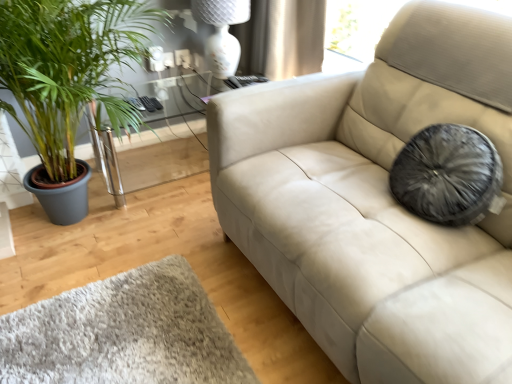
Describe the element at coordinates (68, 69) in the screenshot. I see `green leafy plant at left` at that location.

Describe the element at coordinates (167, 133) in the screenshot. I see `clear glass table at left` at that location.

Identify the location of clear glass table at left. (167, 133).

Locate an element on the screen. Image resolution: width=512 pixels, height=384 pixels. white glossy lamp at upper center is located at coordinates (222, 33).

At what (x,y) coordinates should I click in order to perform the action: click on table on the right of green leafy plant at left. Please return your answer as a coordinate pair (x, y). This screenshot has height=384, width=512. Looking at the image, I should click on (167, 133).

Could you tell me if clear glass table at left is facing green leafy plant at left?

Yes, clear glass table at left is aimed at green leafy plant at left.

Does clear glass table at left have a lesser height compared to green leafy plant at left?

Correct, clear glass table at left is not as tall as green leafy plant at left.

Is clear glass table at left far away from green leafy plant at left?

They are positioned close to each other.

Based on the photo, can we say white glossy lamp at upper center lies outside clear glass table at left?

Yes, white glossy lamp at upper center is outside of clear glass table at left.

Which object is positioned more to the left, white glossy lamp at upper center or clear glass table at left?

Positioned to the left is clear glass table at left.

Between white glossy lamp at upper center and clear glass table at left, which one has smaller size?

With smaller size is white glossy lamp at upper center.

This screenshot has height=384, width=512. In order to click on lamp behind the clear glass table at left in this screenshot , I will do `click(222, 33)`.

From a real-world perspective, which object stands above the other?

white glossy lamp at upper center, from a real-world perspective.

Measure the distance between clear glass table at left and white glossy lamp at upper center.

clear glass table at left and white glossy lamp at upper center are 17.45 inches apart.

Is clear glass table at left closer to the viewer compared to white glossy lamp at upper center?

That is True.

In the scene shown: Do you think clear glass table at left is within white glossy lamp at upper center, or outside of it?

clear glass table at left is spatially situated outside white glossy lamp at upper center.

Considering the relative positions of white glossy lamp at upper center and green leafy plant at left in the image provided, is white glossy lamp at upper center in front of green leafy plant at left?

No, white glossy lamp at upper center is behind green leafy plant at left.

Consider the image. Between white glossy lamp at upper center and green leafy plant at left, which one has larger size?

green leafy plant at left is bigger.

From a real-world perspective, is white glossy lamp at upper center beneath green leafy plant at left?

Incorrect, from a real-world perspective, white glossy lamp at upper center is higher than green leafy plant at left.

Which point is more forward, (233, 1) or (123, 33)?

The point (123, 33) is in front.

How much distance is there between green leafy plant at left and clear glass table at left?

green leafy plant at left is 50.92 centimeters from clear glass table at left.

From the image's perspective, between green leafy plant at left and clear glass table at left, which one is located above?

green leafy plant at left.

Could you tell me if green leafy plant at left is facing clear glass table at left?

No.

Considering the points (129, 121) and (189, 121), which point is in front, point (129, 121) or point (189, 121)?

The point (129, 121) is closer.

In the image, is green leafy plant at left on the left side or the right side of white glossy lamp at upper center?

Based on their positions, green leafy plant at left is located to the left of white glossy lamp at upper center.

Is green leafy plant at left far away from white glossy lamp at upper center?

That's not correct — green leafy plant at left is a little close to white glossy lamp at upper center.

Is green leafy plant at left turned away from white glossy lamp at upper center?

No, green leafy plant at left's orientation is not away from white glossy lamp at upper center.

Choose the correct answer: Is green leafy plant at left inside white glossy lamp at upper center or outside it?

green leafy plant at left cannot be found inside white glossy lamp at upper center.

Where is `houseplant above the clear glass table at left (from the image's perspective)`? The height and width of the screenshot is (384, 512). houseplant above the clear glass table at left (from the image's perspective) is located at coordinates (68, 69).

Identify the location of lamp above the clear glass table at left (from a real-world perspective). (222, 33).

Which object lies further to the anchor point white glossy lamp at upper center, green leafy plant at left or clear glass table at left?

green leafy plant at left is positioned further to the anchor white glossy lamp at upper center.

Consider the image. Based on their spatial positions, is white glossy lamp at upper center or green leafy plant at left closer to clear glass table at left?

Among the two, white glossy lamp at upper center is located nearer to clear glass table at left.

Looking at the image, which one is located closer to green leafy plant at left, white glossy lamp at upper center or clear glass table at left?

clear glass table at left is positioned closer to the anchor green leafy plant at left.

When comparing their distances from green leafy plant at left, does clear glass table at left or white glossy lamp at upper center seem closer?

The object closer to green leafy plant at left is clear glass table at left.

Which object lies further to the anchor point white glossy lamp at upper center, clear glass table at left or green leafy plant at left?

Among the two, green leafy plant at left is located further to white glossy lamp at upper center.

Which object lies further to the anchor point clear glass table at left, green leafy plant at left or white glossy lamp at upper center?

green leafy plant at left lies further to clear glass table at left than the other object.

Locate an element on the screen. The width and height of the screenshot is (512, 384). table located between green leafy plant at left and white glossy lamp at upper center in the depth direction is located at coordinates (167, 133).